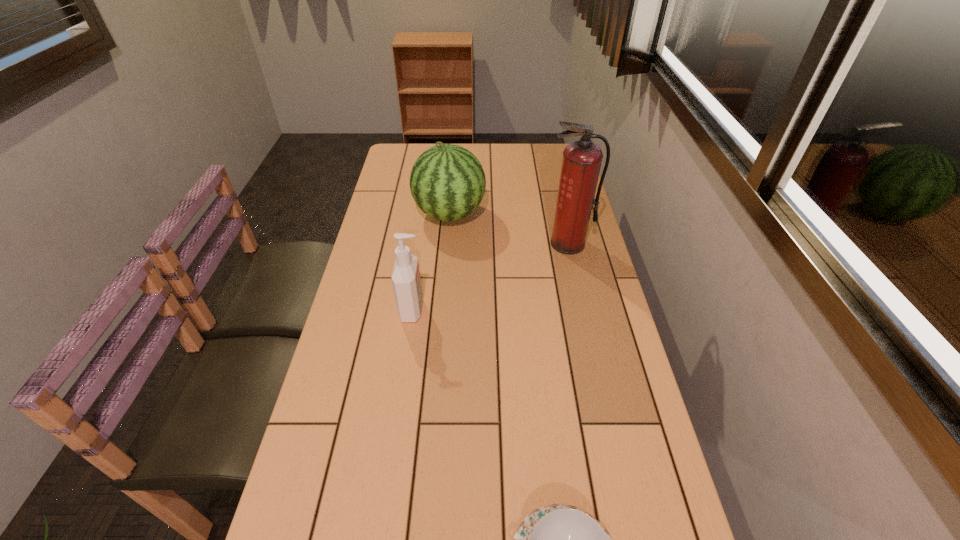
The width and height of the screenshot is (960, 540). I want to click on free region at the left edge, so click(389, 228).

Where is `vacant space at the right edge`? The width and height of the screenshot is (960, 540). vacant space at the right edge is located at coordinates (630, 456).

Where is `free area in between the second nearest object and the tallest object`? The image size is (960, 540). free area in between the second nearest object and the tallest object is located at coordinates (491, 276).

The image size is (960, 540). Find the location of `empty location between the fire extinguisher and the watermelon`. empty location between the fire extinguisher and the watermelon is located at coordinates (509, 229).

Image resolution: width=960 pixels, height=540 pixels. I want to click on free area in between the watermelon and the second nearest object, so click(x=431, y=262).

Locate an element on the screen. free space between the watermelon and the cleansing agent is located at coordinates (431, 262).

Where is `vacant area that lies between the cleansing agent and the watermelon`? vacant area that lies between the cleansing agent and the watermelon is located at coordinates (431, 262).

Where is `the third closest object to the cleansing agent`? The width and height of the screenshot is (960, 540). the third closest object to the cleansing agent is located at coordinates (559, 539).

Find the location of a particular element. This screenshot has height=540, width=960. object that is the third nearest to the watermelon is located at coordinates (559, 539).

In order to click on free space that satisfies the following two spatial constraints: 1. at the nozzle of the fire extinguisher; 2. on the front label of the cleansing agent in this screenshot , I will do `click(583, 309)`.